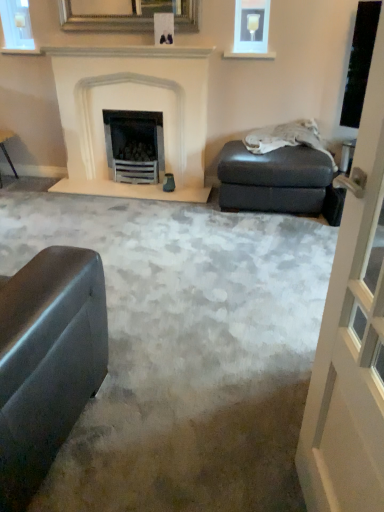
Question: Are transparent glass screen door at right and white stone fireplace at center making contact?

Choices:
 (A) no
 (B) yes

Answer: (A)

Question: Considering the relative positions of transparent glass screen door at right and white stone fireplace at center in the image provided, is transparent glass screen door at right to the left of white stone fireplace at center from the viewer's perspective?

Choices:
 (A) no
 (B) yes

Answer: (A)

Question: Is transparent glass screen door at right shorter than white stone fireplace at center?

Choices:
 (A) yes
 (B) no

Answer: (B)

Question: From the image's perspective, is transparent glass screen door at right beneath white stone fireplace at center?

Choices:
 (A) yes
 (B) no

Answer: (A)

Question: From a real-world perspective, is transparent glass screen door at right physically below white stone fireplace at center?

Choices:
 (A) yes
 (B) no

Answer: (B)

Question: From the image's perspective, is white stone fireplace at center above or below matte gray footrest at right?

Choices:
 (A) below
 (B) above

Answer: (B)

Question: In terms of height, does white stone fireplace at center look taller or shorter compared to matte gray footrest at right?

Choices:
 (A) tall
 (B) short

Answer: (A)

Question: Does point (201, 106) appear closer or farther from the camera than point (331, 175)?

Choices:
 (A) closer
 (B) farther

Answer: (B)

Question: Is white stone fireplace at center inside the boundaries of matte gray footrest at right, or outside?

Choices:
 (A) outside
 (B) inside

Answer: (A)

Question: Considering the positions of gold-framed mirror at upper center, which is the first picture frame in left-to-right order, and matte gray footrest at right in the image, is gold-framed mirror at upper center, which is the first picture frame in left-to-right order, bigger or smaller than matte gray footrest at right?

Choices:
 (A) small
 (B) big

Answer: (A)

Question: In terms of height, does gold-framed mirror at upper center, which is the first picture frame in left-to-right order, look taller or shorter compared to matte gray footrest at right?

Choices:
 (A) tall
 (B) short

Answer: (B)

Question: Would you say gold-framed mirror at upper center, positioned as the 2th picture frame in right-to-left order, is inside or outside matte gray footrest at right?

Choices:
 (A) inside
 (B) outside

Answer: (B)

Question: From a real-world perspective, relative to matte gray footrest at right, is gold-framed mirror at upper center, positioned as the 2th picture frame in right-to-left order, vertically above or below?

Choices:
 (A) above
 (B) below

Answer: (A)

Question: Is matte gray footrest at right to the left or to the right of transparent glass screen door at right in the image?

Choices:
 (A) right
 (B) left

Answer: (A)

Question: Looking at their shapes, would you say matte gray footrest at right is wider or thinner than transparent glass screen door at right?

Choices:
 (A) wide
 (B) thin

Answer: (A)